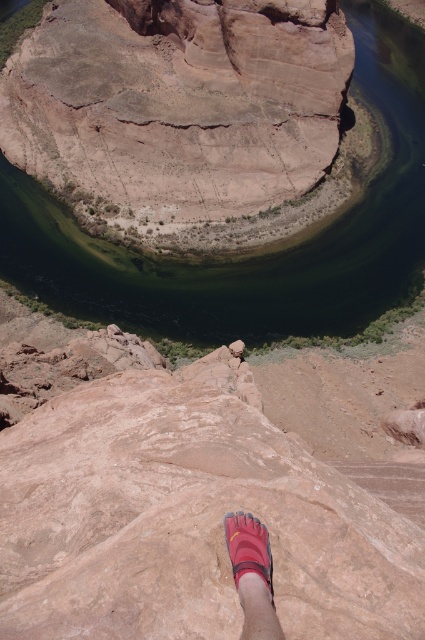
You are standing at the cliff edge overlooking the river and want to place a small flag at each of the two points marked in the image. The first flag is at point (x=393, y=193) and the second at point (x=246, y=544). Which flag will be closer to your current position?

The flag at point (x=393, y=193) will be closer to your current position because it is further to the viewer than point (x=246, y=544).

You are a hiker who wants to take a photo of the dark green water at center and the pink fabric foot at lower center. Which object is wider in the image?

The dark green water at center is wider than the pink fabric foot at lower center.